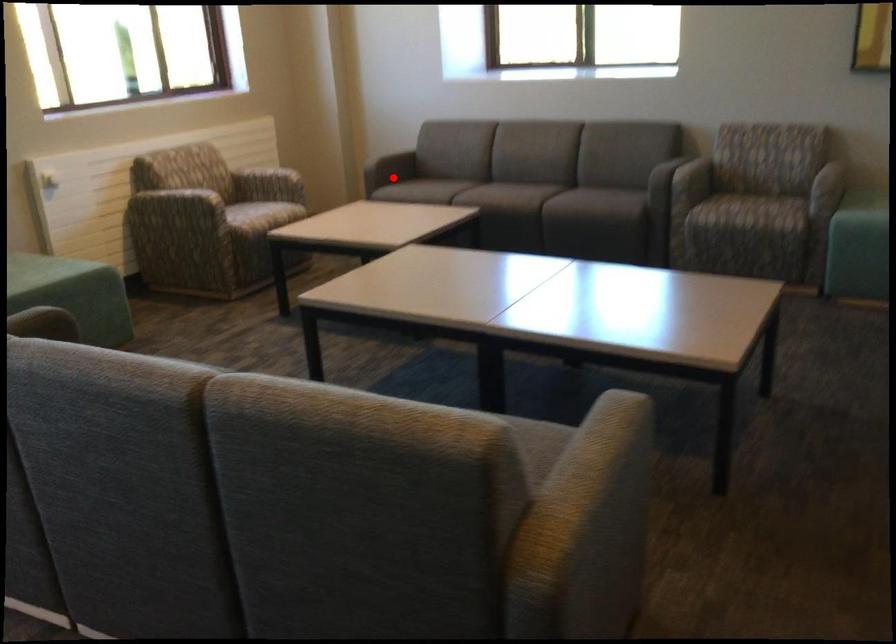
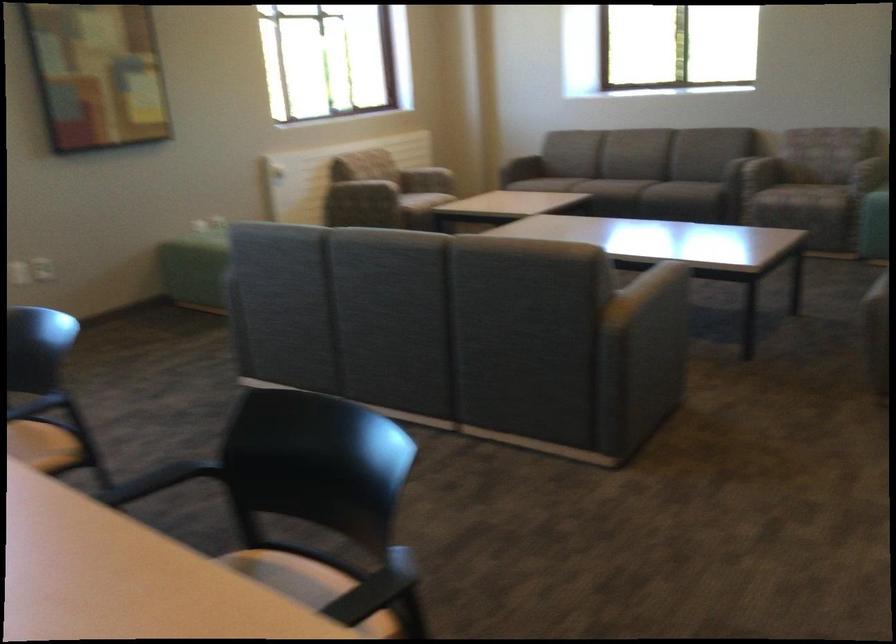
Question: I am providing you with two images of the same scene from different viewpoints. Image1 has a red point marked. In image2, the corresponding 3D location appears at what relative position? Reply with the corresponding letter.

Choices:
 (A) Closer
 (B) Farther

Answer: (B)